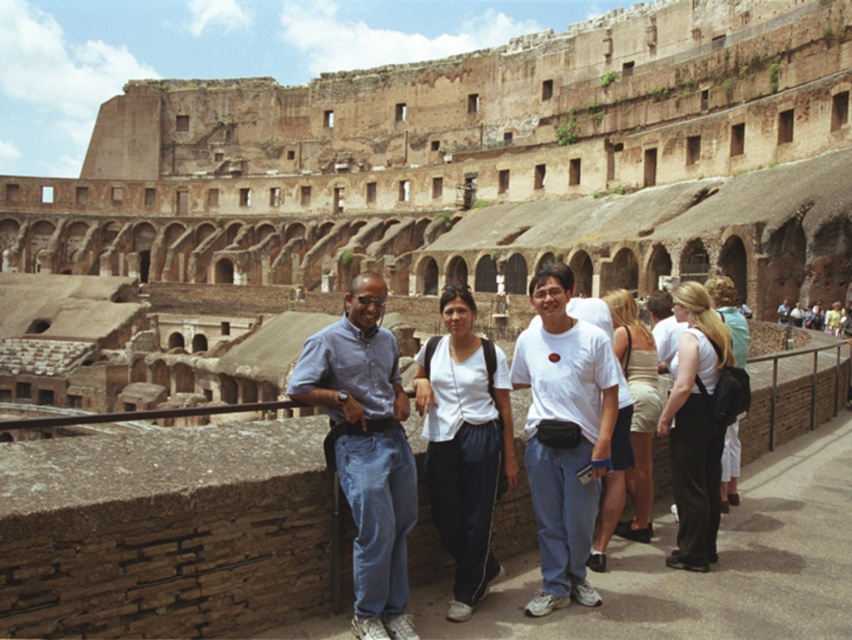
Question: Considering the real-world distances, which object is farthest from the beige fabric skirt at center?

Choices:
 (A) light brown fabric backpack at right
 (B) blue denim jeans at center
 (C) white cotton shirt at center

Answer: (B)

Question: Estimate the real-world distances between objects in this image. Which object is closer to the blue denim jeans at center?

Choices:
 (A) light brown fabric backpack at right
 (B) white matte t-shirt at center

Answer: (B)

Question: Can you confirm if white fabric pants at center is positioned below light brown fabric backpack at right?

Choices:
 (A) no
 (B) yes

Answer: (B)

Question: Based on their relative distances, which object is farther from the white matte t-shirt at center?

Choices:
 (A) beige fabric skirt at center
 (B) white cotton shirt at center
 (C) blue denim jeans at center

Answer: (C)

Question: Where is blue denim jeans at center located in relation to white cotton shirt at center in the image?

Choices:
 (A) below
 (B) above

Answer: (B)

Question: Is white fabric pants at center thinner than light brown fabric backpack at right?

Choices:
 (A) no
 (B) yes

Answer: (B)